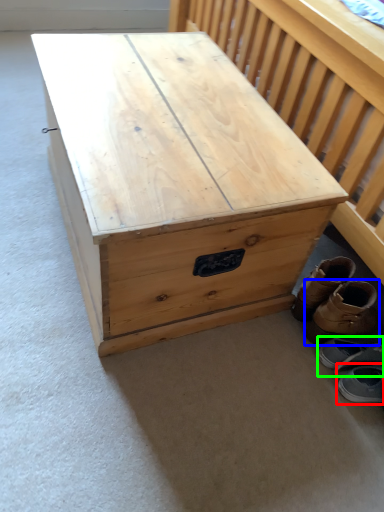
Question: Estimate the real-world distances between objects in this image. Which object is closer to footwear (highlighted by a red box), footwear (highlighted by a blue box) or footwear (highlighted by a green box)?

Choices:
 (A) footwear
 (B) footwear

Answer: (B)